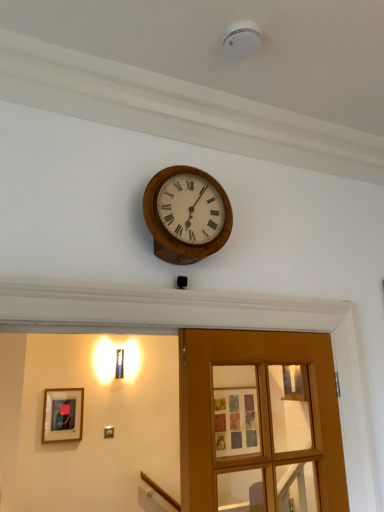
Question: Does wooden wall clock at upper center have a larger size compared to wooden framed picture at lower left?

Choices:
 (A) no
 (B) yes

Answer: (B)

Question: From a real-world perspective, is wooden wall clock at upper center located higher than wooden framed picture at lower left?

Choices:
 (A) yes
 (B) no

Answer: (A)

Question: Is wooden wall clock at upper center placed right next to wooden framed picture at lower left?

Choices:
 (A) yes
 (B) no

Answer: (B)

Question: From the image's perspective, would you say wooden wall clock at upper center is shown under wooden framed picture at lower left?

Choices:
 (A) no
 (B) yes

Answer: (A)

Question: Does wooden wall clock at upper center have a greater width compared to wooden framed picture at lower left?

Choices:
 (A) no
 (B) yes

Answer: (B)

Question: Are wooden wall clock at upper center and wooden framed picture at lower left located far from each other?

Choices:
 (A) yes
 (B) no

Answer: (A)

Question: Is wooden glass door at center touching wooden framed picture at lower left?

Choices:
 (A) yes
 (B) no

Answer: (B)

Question: Could you tell me if wooden glass door at center is facing wooden framed picture at lower left?

Choices:
 (A) no
 (B) yes

Answer: (A)

Question: From a real-world perspective, is wooden glass door at center located beneath wooden framed picture at lower left?

Choices:
 (A) yes
 (B) no

Answer: (B)

Question: Is wooden framed picture at lower left completely or partially inside wooden glass door at center?

Choices:
 (A) yes
 (B) no

Answer: (B)

Question: Does wooden glass door at center have a lesser width compared to wooden framed picture at lower left?

Choices:
 (A) no
 (B) yes

Answer: (A)

Question: Would you consider wooden glass door at center to be distant from wooden framed picture at lower left?

Choices:
 (A) yes
 (B) no

Answer: (A)

Question: Considering the relative positions of wooden framed picture at lower left and wooden glass door at center in the image provided, is wooden framed picture at lower left to the left of wooden glass door at center from the viewer's perspective?

Choices:
 (A) no
 (B) yes

Answer: (B)